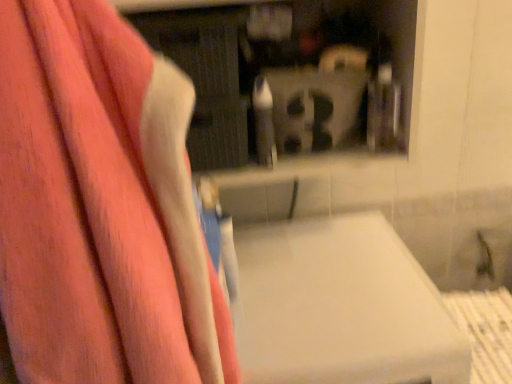
Describe the element at coordinates (340, 307) in the screenshot. I see `white matte lift at center` at that location.

Locate an element on the screen. The width and height of the screenshot is (512, 384). pink fabric towel at left is located at coordinates (101, 207).

Identify the location of white matte lift at center. pos(340,307).

Is matte plastic shelf at upper center completely or partially outside of white matte lift at center?

Absolutely, matte plastic shelf at upper center is external to white matte lift at center.

Considering the relative sizes of matte plastic shelf at upper center and white matte lift at center in the image provided, is matte plastic shelf at upper center shorter than white matte lift at center?

Correct, matte plastic shelf at upper center is not as tall as white matte lift at center.

Is the position of matte plastic shelf at upper center more distant than that of white matte lift at center?

That is True.

From a real-world perspective, who is located higher, matte plastic shelf at upper center or white matte lift at center?

In real-world perspective, matte plastic shelf at upper center is above.

Between pink fabric towel at left and white matte lift at center, which one has smaller size?

With smaller size is pink fabric towel at left.

Considering the positions of objects pink fabric towel at left and white matte lift at center in the image provided, who is more to the right, pink fabric towel at left or white matte lift at center?

From the viewer's perspective, white matte lift at center appears more on the right side.

From the image's perspective, between pink fabric towel at left and white matte lift at center, who is located below?

white matte lift at center appears lower in the image.

Image resolution: width=512 pixels, height=384 pixels. What are the coordinates of `towel in front of the white matte lift at center` in the screenshot? It's located at (101, 207).

This screenshot has width=512, height=384. Find the location of `towel below the matte plastic shelf at upper center (from a real-world perspective)`. towel below the matte plastic shelf at upper center (from a real-world perspective) is located at coordinates (101, 207).

In the scene shown: How many degrees apart are the facing directions of pink fabric towel at left and matte plastic shelf at upper center?

pink fabric towel at left and matte plastic shelf at upper center are facing 87.1 degrees away from each other.

From the image's perspective, which is above, pink fabric towel at left or matte plastic shelf at upper center?

matte plastic shelf at upper center, from the image's perspective.

Considering the positions of objects pink fabric towel at left and matte plastic shelf at upper center in the image provided, who is more to the right, pink fabric towel at left or matte plastic shelf at upper center?

From the viewer's perspective, matte plastic shelf at upper center appears more on the right side.

From the image's perspective, is white matte lift at center above or below pink fabric towel at left?

white matte lift at center is below pink fabric towel at left.

Is white matte lift at center not within pink fabric towel at left?

That's correct, white matte lift at center is outside of pink fabric towel at left.

Who is taller, white matte lift at center or pink fabric towel at left?

pink fabric towel at left is taller.

Is point (306, 381) behind point (31, 285)?

Yes, it is.

Does matte plastic shelf at upper center touch pink fabric towel at left?

No, matte plastic shelf at upper center is not making contact with pink fabric towel at left.

Is point (323, 122) farther from viewer compared to point (7, 76)?

Yes, point (323, 122) is farther from viewer.

From the image's perspective, is matte plastic shelf at upper center above or below pink fabric towel at left?

matte plastic shelf at upper center is above pink fabric towel at left.

In the scene shown: Considering the relative sizes of matte plastic shelf at upper center and pink fabric towel at left in the image provided, is matte plastic shelf at upper center taller than pink fabric towel at left?

No.

Is white matte lift at center behind matte plastic shelf at upper center?

No, the depth of white matte lift at center is less than that of matte plastic shelf at upper center.

How far apart are white matte lift at center and matte plastic shelf at upper center?

white matte lift at center is 13.36 inches from matte plastic shelf at upper center.

Is white matte lift at center oriented towards matte plastic shelf at upper center?

No.

Which of these two, white matte lift at center or matte plastic shelf at upper center, stands taller?

white matte lift at center is taller.

Identify the location of shelf positioned vertically above the white matte lift at center (from a real-world perspective). This screenshot has width=512, height=384. (286, 70).

This screenshot has height=384, width=512. In the image, there is a white matte lift at center. In order to click on towel above it (from the image's perspective) in this screenshot , I will do `click(101, 207)`.

Looking at the image, which one is located closer to white matte lift at center, pink fabric towel at left or matte plastic shelf at upper center?

The object closer to white matte lift at center is pink fabric towel at left.

Estimate the real-world distances between objects in this image. Which object is further from matte plastic shelf at upper center, pink fabric towel at left or white matte lift at center?

pink fabric towel at left is positioned further to the anchor matte plastic shelf at upper center.

Considering their positions, is white matte lift at center positioned further to matte plastic shelf at upper center than pink fabric towel at left?

pink fabric towel at left is further to matte plastic shelf at upper center.

From the picture: Which object lies nearer to the anchor point white matte lift at center, matte plastic shelf at upper center or pink fabric towel at left?

Based on the image, pink fabric towel at left appears to be nearer to white matte lift at center.

When comparing their distances from pink fabric towel at left, does matte plastic shelf at upper center or white matte lift at center seem further?

matte plastic shelf at upper center is further to pink fabric towel at left.

Which object lies further to the anchor point pink fabric towel at left, white matte lift at center or matte plastic shelf at upper center?

matte plastic shelf at upper center is further to pink fabric towel at left.

The height and width of the screenshot is (384, 512). Identify the location of towel between matte plastic shelf at upper center and white matte lift at center from top to bottom. (101, 207).